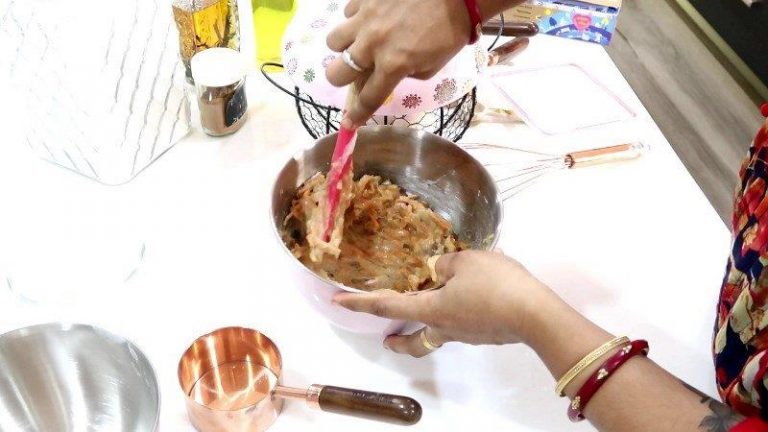
Locate an element on the screen. Image resolution: width=768 pixels, height=432 pixels. metallic whisk is located at coordinates (586, 159).